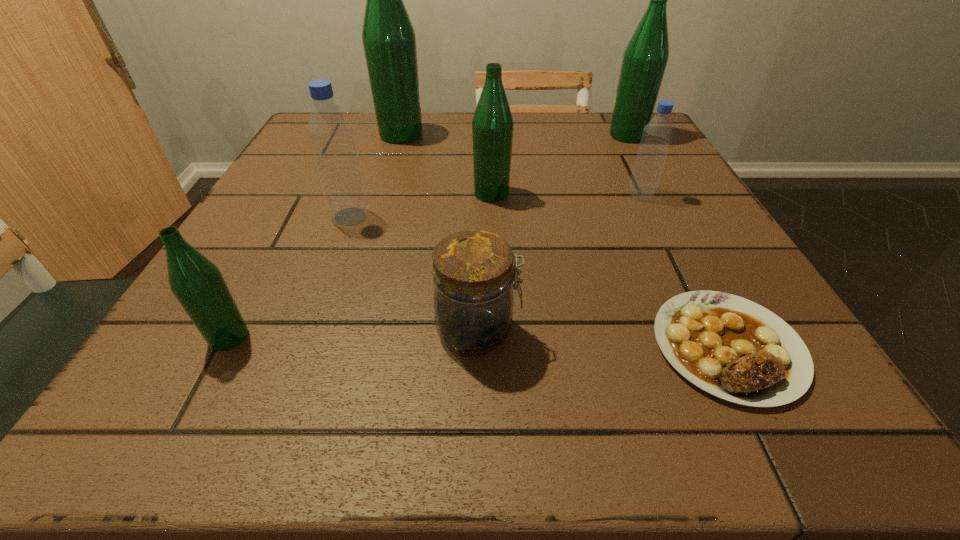
Locate an element on the screen. This screenshot has height=540, width=960. the second closest object to the nearest green bottle is located at coordinates (473, 273).

Locate an element on the screen. This screenshot has height=540, width=960. the sixth closest object to the jar is located at coordinates (389, 41).

Locate which bottle is the second closest to the fifth farthest object. Please provide its 2D coordinates. Your answer should be formatted as a tuple, i.e. [(x, y)], where the tuple contains the x and y coordinates of a point satisfying the conditions above.

[(197, 283)]

Where is `the third closest bottle to the bigger blue bottle`? This screenshot has width=960, height=540. the third closest bottle to the bigger blue bottle is located at coordinates (389, 41).

Select which green bottle is the second closest to the farther blue bottle. Please provide its 2D coordinates. Your answer should be formatted as a tuple, i.e. [(x, y)], where the tuple contains the x and y coordinates of a point satisfying the conditions above.

[(492, 124)]

At what (x,y) coordinates should I click in order to perform the action: click on green bottle that stands as the third closest to the tallest bottle. Please return your answer as a coordinate pair (x, y). The width and height of the screenshot is (960, 540). Looking at the image, I should click on (197, 283).

At what (x,y) coordinates should I click in order to perform the action: click on vacant area in the image that satisfies the following two spatial constraints: 1. on the front side of the third farthest green bottle; 2. on the lid of the second shortest object. Please return your answer as a coordinate pair (x, y). This screenshot has width=960, height=540. Looking at the image, I should click on (496, 331).

Where is `free point that satisfies the following two spatial constraints: 1. on the back side of the nearer blue bottle; 2. on the left side of the tallest bottle`? free point that satisfies the following two spatial constraints: 1. on the back side of the nearer blue bottle; 2. on the left side of the tallest bottle is located at coordinates (381, 135).

This screenshot has width=960, height=540. I want to click on vacant space that satisfies the following two spatial constraints: 1. on the front side of the smaller blue bottle; 2. on the lid of the jar, so click(708, 331).